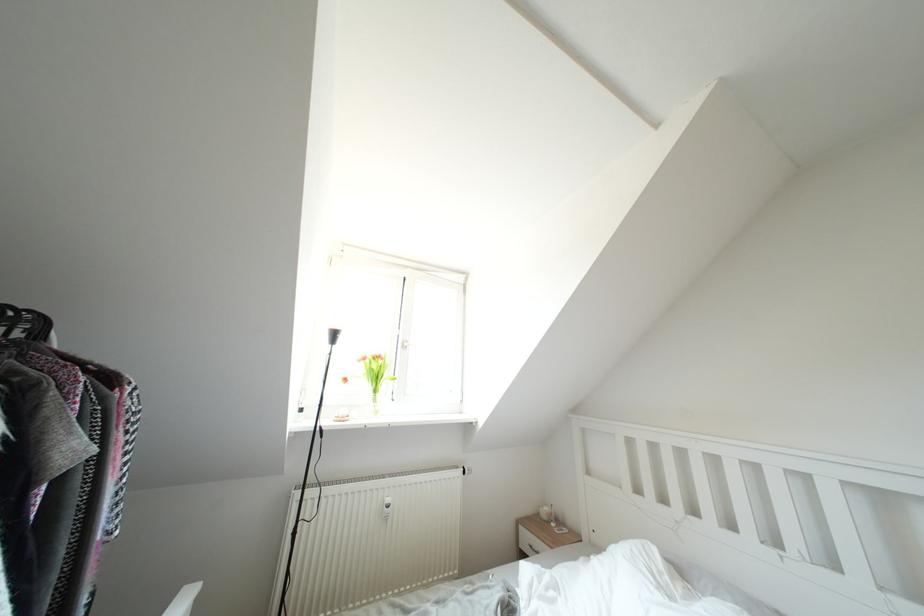
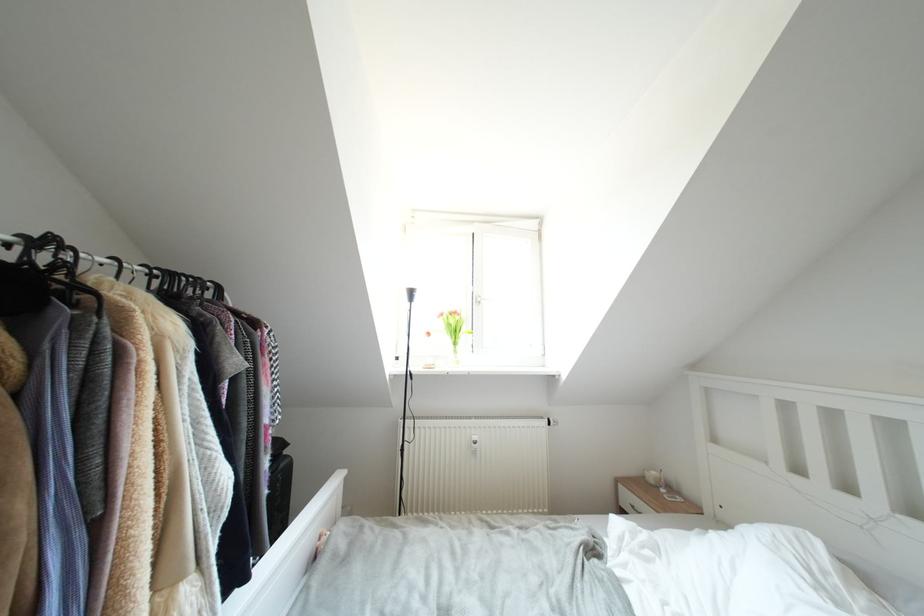
Question: The camera is either moving clockwise (left) or counter-clockwise (right) around the object. The first image is from the beginning of the video and the second image is from the end. Is the camera moving left or right when shooting the video?

Choices:
 (A) Left
 (B) Right

Answer: (B)